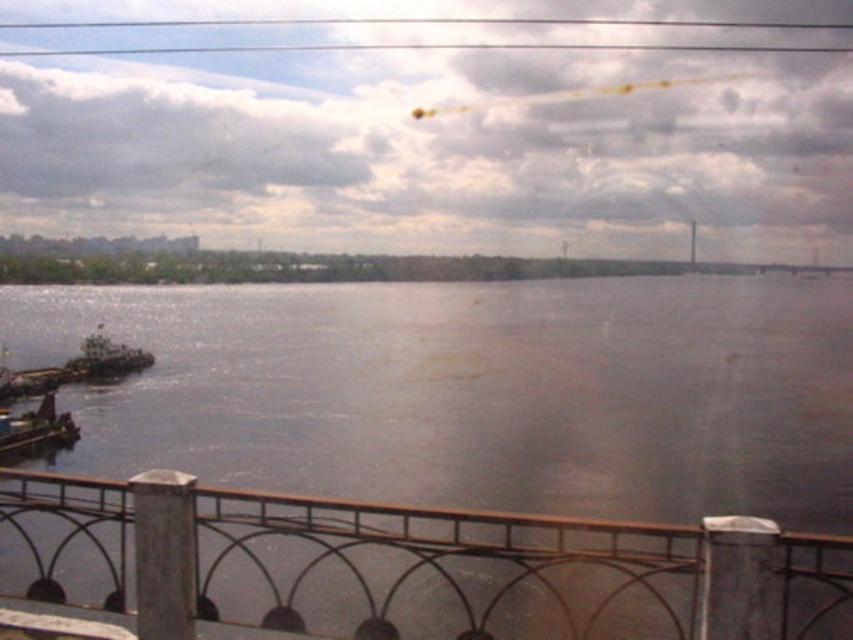
You are standing on the bridge looking at the river. There are two points marked on the image. Which point, point (x=682, y=561) or point (x=7, y=436), is closer to you?

Point (x=682, y=561) is closer to you than point (x=7, y=436).

You are standing on the bridge and want to take a photo of the dark brown water at center and the white matte boat at left. Which object will appear larger in your photo?

The dark brown water at center will appear larger in the photo because it is closer to the viewer than the white matte boat at left.

You are standing on the bridge and see the wooden boat at lower left and the white matte boat at left. Which boat is closer to the left edge of the bridge?

The wooden boat at lower left is closer to the left edge of the bridge because it is positioned to the left of the white matte boat at left.